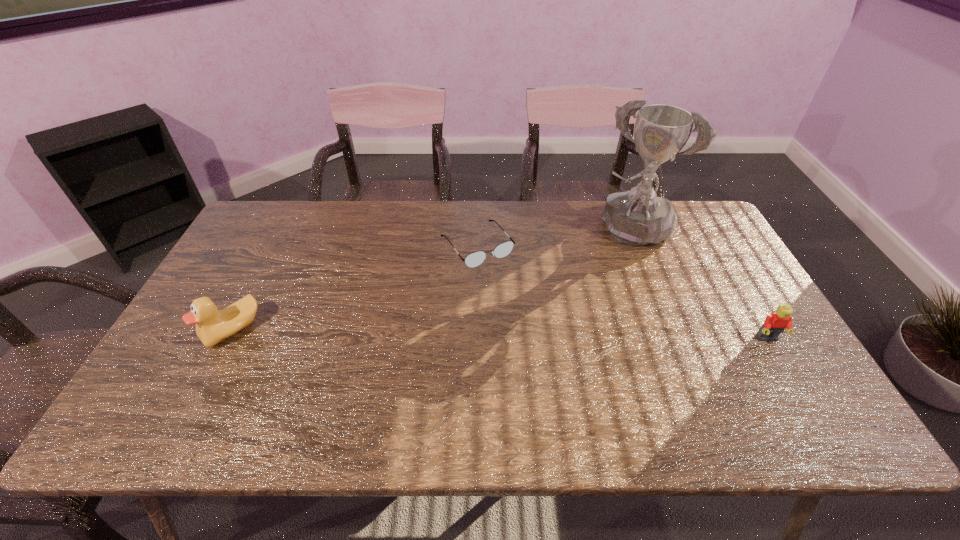
This screenshot has height=540, width=960. I want to click on free spot on the desktop that is between the leftmost object and the rightmost object and is positioned on the lenses of the second object from left to right, so click(547, 335).

Image resolution: width=960 pixels, height=540 pixels. Identify the location of free space on the desktop that is between the leftmost object and the rightmost object and is positioned on the side with emblem of the third object from left to right. (559, 335).